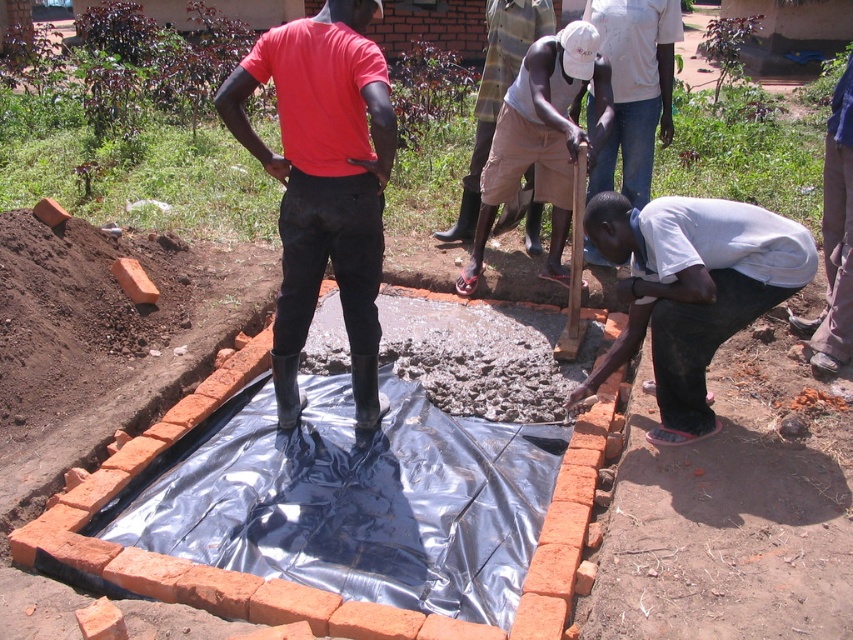
Consider the image. Can you confirm if rubber boots at center is positioned above light brown shorts at center?

Actually, rubber boots at center is below light brown shorts at center.

Measure the distance between rubber boots at center and camera.

rubber boots at center and camera are 3.06 meters apart from each other.

Where is `rubber boots at center`? This screenshot has height=640, width=853. rubber boots at center is located at coordinates (323, 182).

Does rubber boots at center appear on the right side of gray cotton shirt at lower right?

In fact, rubber boots at center is to the left of gray cotton shirt at lower right.

Does rubber boots at center have a greater height compared to gray cotton shirt at lower right?

Yes, rubber boots at center is taller than gray cotton shirt at lower right.

Is point (286, 65) positioned in front of point (625, 17)?

Yes, point (286, 65) is closer to viewer.

This screenshot has width=853, height=640. I want to click on rubber boots at center, so click(x=323, y=182).

Is white matte shirt at lower right shorter than light brown shorts at center?

Yes, white matte shirt at lower right is shorter than light brown shorts at center.

Which of these two, white matte shirt at lower right or light brown shorts at center, stands taller?

light brown shorts at center is taller.

Describe the element at coordinates (691, 291) in the screenshot. This screenshot has width=853, height=640. I see `white matte shirt at lower right` at that location.

Locate an element on the screen. This screenshot has width=853, height=640. white matte shirt at lower right is located at coordinates (691, 291).